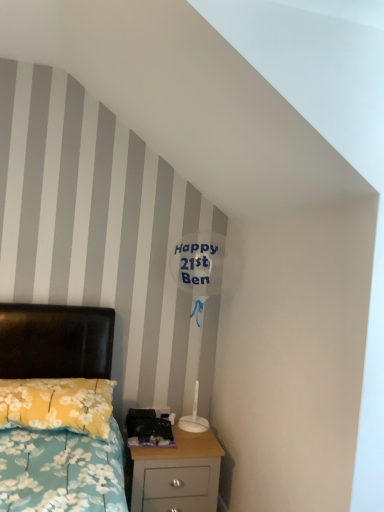
Question: Is point (173, 480) positioned closer to the camera than point (41, 404)?

Choices:
 (A) closer
 (B) farther

Answer: (B)

Question: Is light wood nightstand at lower right inside the boundaries of yellow floral fabric pillow at lower left, or outside?

Choices:
 (A) inside
 (B) outside

Answer: (B)

Question: Estimate the real-world distances between objects in this image. Which object is farther from the transparent plastic balloon at upper center?

Choices:
 (A) light wood nightstand at lower right
 (B) yellow floral fabric pillow at lower left

Answer: (B)

Question: Based on their relative distances, which object is farther from the light wood nightstand at lower right?

Choices:
 (A) yellow floral fabric pillow at lower left
 (B) transparent plastic balloon at upper center

Answer: (B)